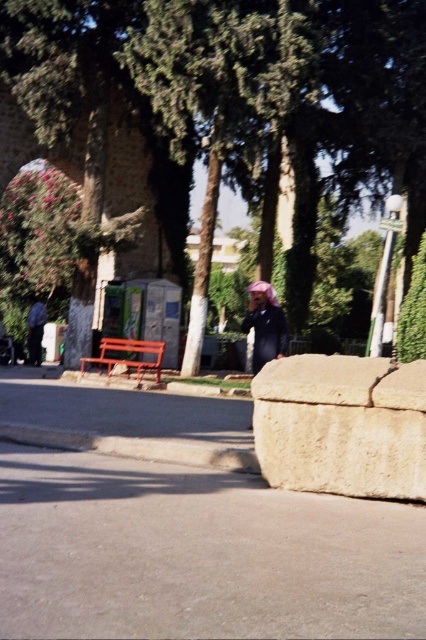
How much distance is there between green leafy tree at center and beige rough stone at lower right?

green leafy tree at center is 11.91 meters from beige rough stone at lower right.

Is point (40, 20) less distant than point (345, 378)?

No, (40, 20) is further to viewer.

Which is behind, point (81, 3) or point (397, 461)?

Positioned behind is point (81, 3).

Where is `green leafy tree at center`? Image resolution: width=426 pixels, height=640 pixels. green leafy tree at center is located at coordinates (241, 72).

The height and width of the screenshot is (640, 426). Identify the location of smooth concrete pavement at lower center. (196, 554).

Which is more to the right, smooth concrete pavement at lower center or dark blue fabric at center?

From the viewer's perspective, dark blue fabric at center appears more on the right side.

Locate an element on the screen. smooth concrete pavement at lower center is located at coordinates (196, 554).

Does point (385, 19) lie in front of point (273, 342)?

That is False.

Does point (273, 19) lie in front of point (253, 369)?

No, (273, 19) is behind (253, 369).

Image resolution: width=426 pixels, height=640 pixels. I want to click on green leafy tree at center, so click(241, 72).